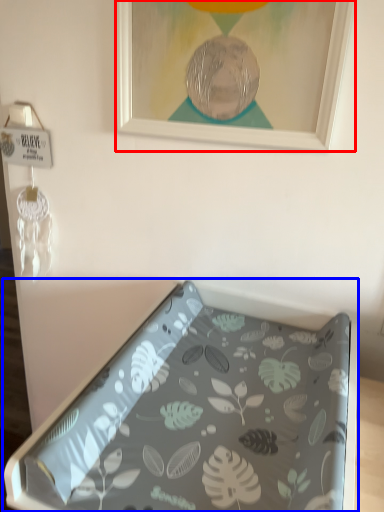
Question: Which of the following is the closest to the observer, picture frame (highlighted by a red box) or furniture (highlighted by a blue box)?

Choices:
 (A) picture frame
 (B) furniture

Answer: (B)